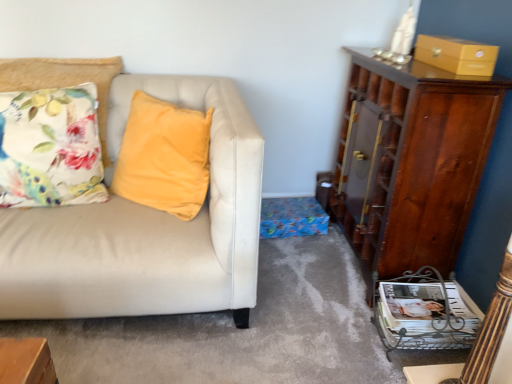
Question: Does floral fabric cushion at left have a lesser width compared to matte yellow box at upper right?

Choices:
 (A) yes
 (B) no

Answer: (B)

Question: Does floral fabric cushion at left appear on the left side of matte yellow box at upper right?

Choices:
 (A) no
 (B) yes

Answer: (B)

Question: Is matte yellow box at upper right at the back of floral fabric cushion at left?

Choices:
 (A) no
 (B) yes

Answer: (A)

Question: Does floral fabric cushion at left have a larger size compared to matte yellow box at upper right?

Choices:
 (A) yes
 (B) no

Answer: (A)

Question: Is floral fabric cushion at left not near matte yellow box at upper right?

Choices:
 (A) yes
 (B) no

Answer: (A)

Question: Is point (450, 49) closer or farther from the camera than point (388, 344)?

Choices:
 (A) farther
 (B) closer

Answer: (B)

Question: Is matte yellow box at upper right in front of or behind white glossy magazine at lower right in the image?

Choices:
 (A) front
 (B) behind

Answer: (A)

Question: Visually, is matte yellow box at upper right positioned to the left or to the right of white glossy magazine at lower right?

Choices:
 (A) left
 (B) right

Answer: (B)

Question: Do you think matte yellow box at upper right is within white glossy magazine at lower right, or outside of it?

Choices:
 (A) outside
 (B) inside

Answer: (A)

Question: From the image's perspective, is matte yellow box at upper right positioned above or below shiny brown cabinet at right?

Choices:
 (A) below
 (B) above

Answer: (B)

Question: Is matte yellow box at upper right wider or thinner than shiny brown cabinet at right?

Choices:
 (A) wide
 (B) thin

Answer: (B)

Question: Considering the relative positions of matte yellow box at upper right and shiny brown cabinet at right in the image provided, is matte yellow box at upper right to the left or to the right of shiny brown cabinet at right?

Choices:
 (A) right
 (B) left

Answer: (A)

Question: From a real-world perspective, is matte yellow box at upper right physically located above or below shiny brown cabinet at right?

Choices:
 (A) below
 (B) above

Answer: (B)

Question: Looking at the image, does white glossy magazine at lower right seem bigger or smaller compared to matte yellow box at upper right?

Choices:
 (A) small
 (B) big

Answer: (B)

Question: Is white glossy magazine at lower right inside the boundaries of matte yellow box at upper right, or outside?

Choices:
 (A) outside
 (B) inside

Answer: (A)